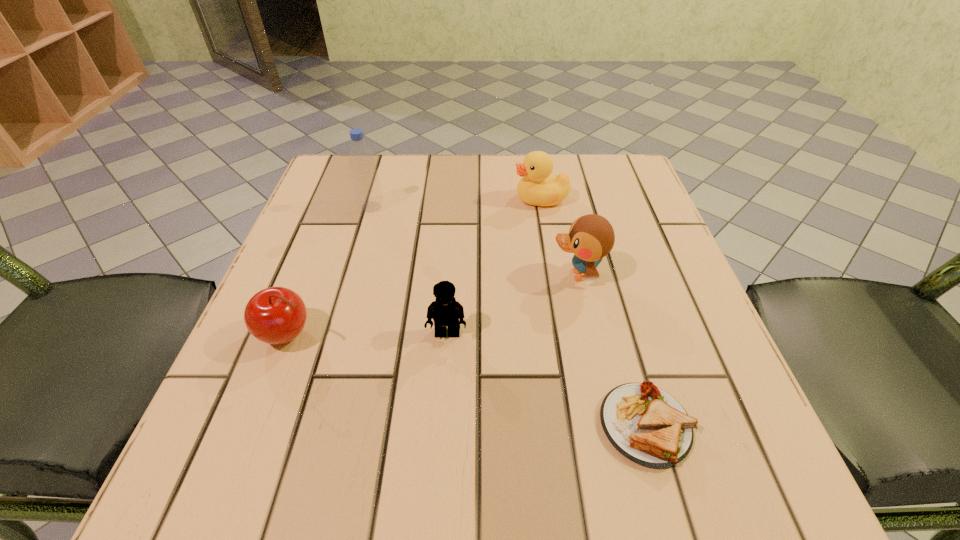
I want to click on bottle that is at the left edge, so click(x=368, y=193).

You are a GUI agent. You are given a task and a screenshot of the screen. Output one action in this format:
    pyautogui.click(x=<x>, y=<y>)
    Task: Click on the cherry that is positioned at the left edge
    The width and height of the screenshot is (960, 540).
    Given the screenshot: What is the action you would take?
    pyautogui.click(x=276, y=315)

Where is `duck positioned at the right edge`? The image size is (960, 540). duck positioned at the right edge is located at coordinates (591, 237).

Locate an element on the screen. The image size is (960, 540). sandwich that is at the right edge is located at coordinates (647, 425).

This screenshot has height=540, width=960. I want to click on object that is at the far left corner, so click(368, 193).

Find the location of a particular element. Image resolution: width=960 pixels, height=540 pixels. object that is at the near right corner is located at coordinates (647, 425).

This screenshot has height=540, width=960. I want to click on vacant space at the far edge, so click(x=431, y=177).

Find the location of a particular element. Image resolution: width=960 pixels, height=540 pixels. free point at the left edge is located at coordinates (239, 361).

The width and height of the screenshot is (960, 540). Find the location of `vacant region at the right edge of the desktop`. vacant region at the right edge of the desktop is located at coordinates (650, 262).

This screenshot has width=960, height=540. What are the coordinates of `vacant space at the far left corner` in the screenshot? It's located at (341, 198).